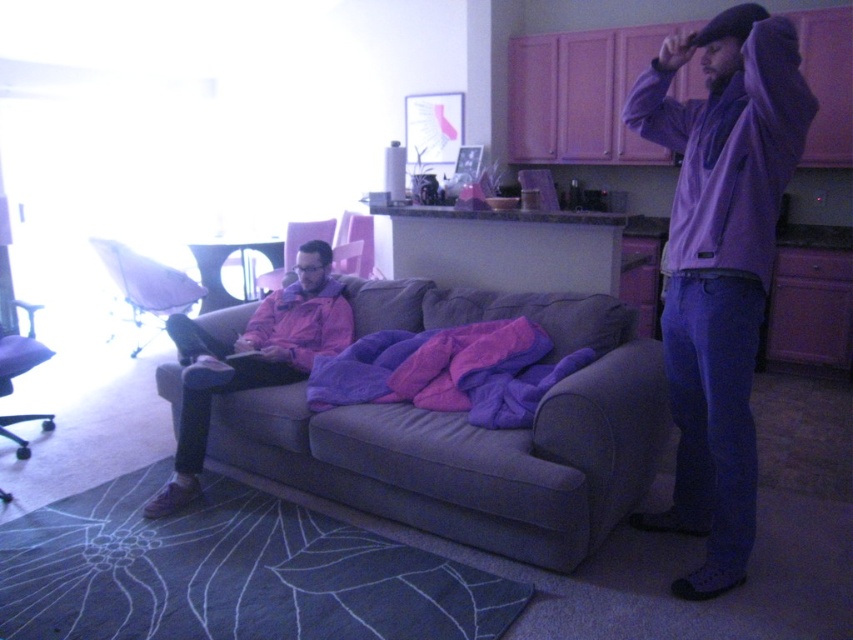
You are standing in the living room and want to sit down. There is a point marked at coordinates (294,250). What object is located at that point?

The point at coordinates (294,250) marks the location of the matte pink armchair at center.

Consider the image. You are a photographer who wants to take a photo of the purple matte hoodie at right. The camera you have is 5 feet in length. If you place the camera on the floor, will you be able to capture the hoodie in the frame without moving the camera?

The distance between the purple matte hoodie at right and the camera is 5.82 feet. Since the camera is only 5 feet long, it won

You are standing in the living room and want to sit on the closest armchair. Which one should you choose between the matte pink armchair at center and the pink fabric armchair at center?

You should choose the matte pink armchair at center because it is closer to you than the pink fabric armchair at center.